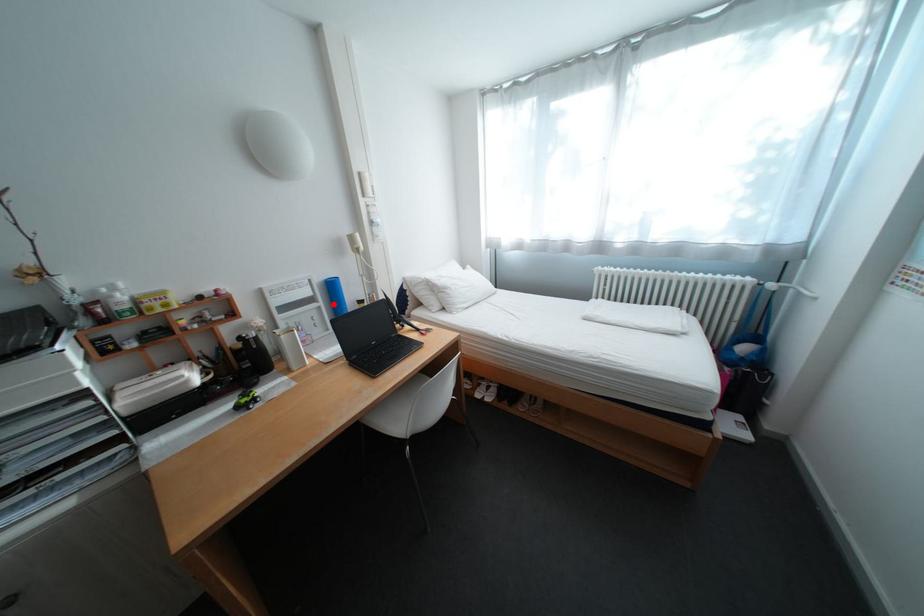
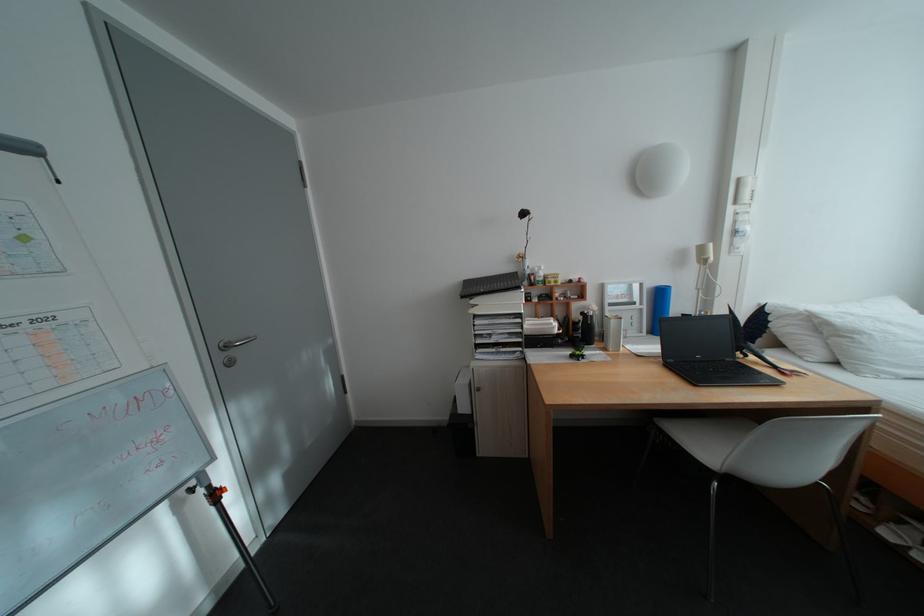
Where in the second image is the point corresponding to the highlighted location from the first image?

(657, 307)